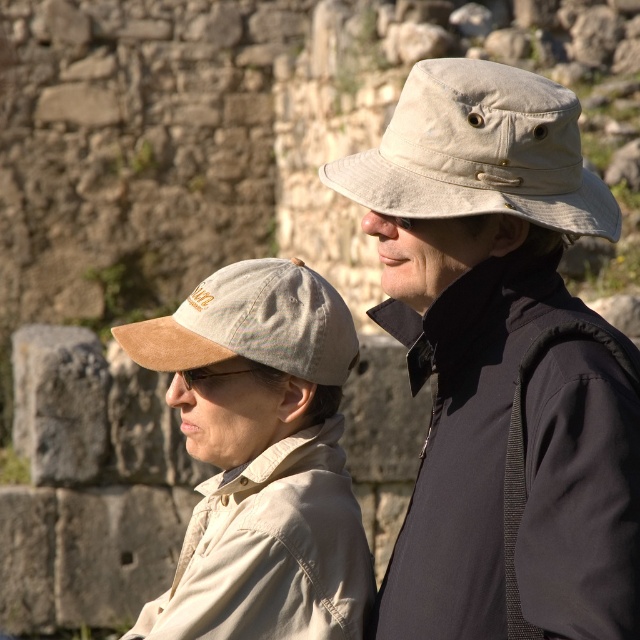
Question: In this image, where is tan suede cap at left located relative to beige fabric baseball cap at upper center?

Choices:
 (A) right
 (B) left

Answer: (B)

Question: Considering the real-world distances, which object is closest to the beige fabric baseball cap at upper center?

Choices:
 (A) tan suede baseball cap at left
 (B) tan suede cap at left
 (C) khaki fabric hat at center

Answer: (C)

Question: Which point is closer to the camera?

Choices:
 (A) (346, 157)
 (B) (332, 314)
 (C) (253, 371)

Answer: (A)

Question: Among these points, which one is farthest from the camera?

Choices:
 (A) (250, 291)
 (B) (196, 396)
 (C) (536, 170)

Answer: (B)

Question: Can you confirm if tan suede baseball cap at left is positioned above matte brown goggles at center?

Choices:
 (A) no
 (B) yes

Answer: (B)

Question: Can you confirm if khaki fabric hat at center is positioned to the left of tan suede baseball cap at left?

Choices:
 (A) no
 (B) yes

Answer: (A)